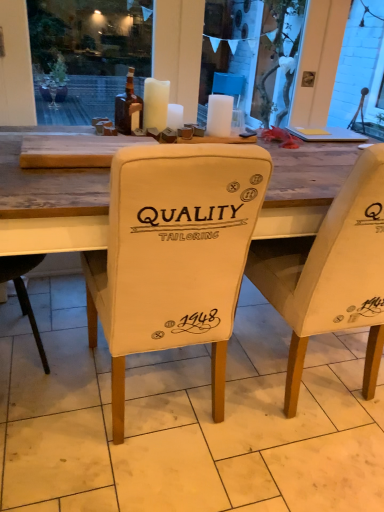
This screenshot has width=384, height=512. In order to click on free space above white fabric chair cover at center (from a real-world perspective) in this screenshot , I will do `click(207, 398)`.